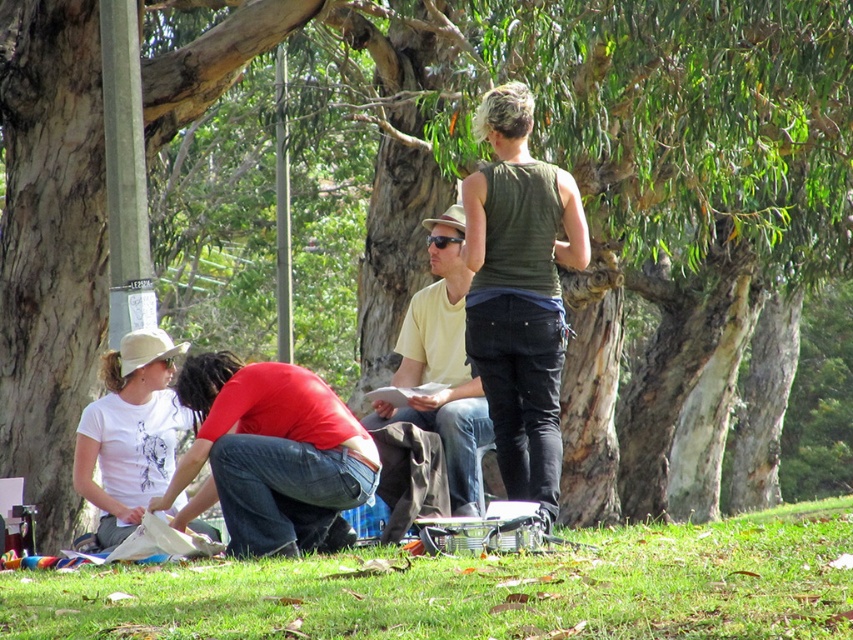
Which is below, red matte shirt at center or yellow matte shirt at center?

red matte shirt at center is lower down.

Can you confirm if red matte shirt at center is positioned to the left of yellow matte shirt at center?

Correct, you'll find red matte shirt at center to the left of yellow matte shirt at center.

I want to click on red matte shirt at center, so click(x=273, y=452).

You are a GUI agent. You are given a task and a screenshot of the screen. Output one action in this format:
    pyautogui.click(x=<x>, y=<y>)
    Task: Click on the red matte shirt at center
    This screenshot has width=853, height=640.
    Given the screenshot: What is the action you would take?
    pyautogui.click(x=273, y=452)

Is red matte shirt at center shorter than white matte t-shirt at lower left?

Indeed, red matte shirt at center has a lesser height compared to white matte t-shirt at lower left.

Who is shorter, red matte shirt at center or white matte t-shirt at lower left?

red matte shirt at center is shorter.

Does point (309, 435) come in front of point (107, 429)?

Yes, it is in front of point (107, 429).

Find the location of a particular element. The height and width of the screenshot is (640, 853). red matte shirt at center is located at coordinates (273, 452).

Is point (474, 608) closer to viewer compared to point (456, 336)?

Yes, point (474, 608) is closer to viewer.

Is point (579, 586) positioned before point (473, 416)?

That is True.

Locate an element on the screen. green grass at lower center is located at coordinates (479, 588).